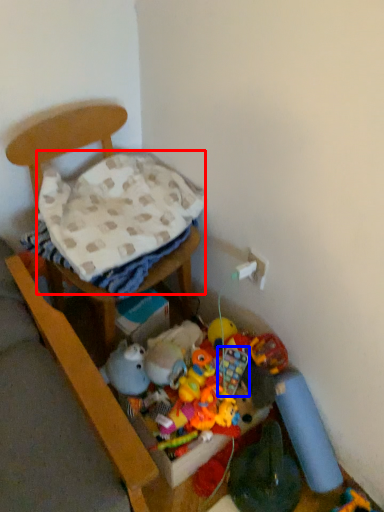
Question: Which object appears closest to the camera in this image, blanket (highlighted by a red box) or toy (highlighted by a blue box)?

Choices:
 (A) blanket
 (B) toy

Answer: (A)